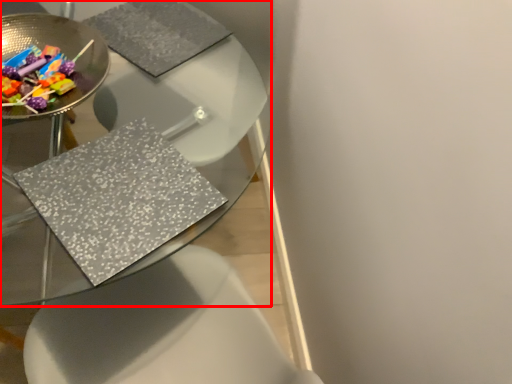
Question: From the image's perspective, what is the correct spatial relationship of table (annotated by the red box) in relation to glass plate?

Choices:
 (A) below
 (B) above

Answer: (A)